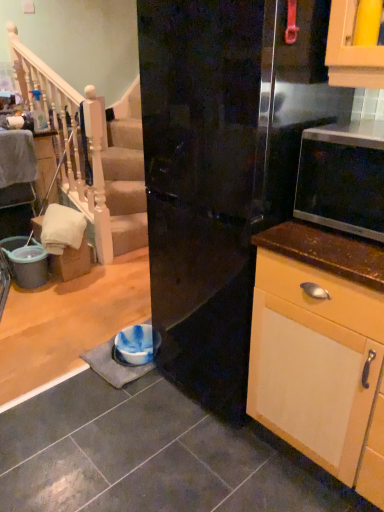
Measure the distance between point (115, 201) and camera.

Point (115, 201) and camera are 3.25 meters apart.

Describe the element at coordinates (91, 156) in the screenshot. I see `white wood railing at upper left` at that location.

What is the approximate height of glossy black refrigerator at center?

It is 5.27 feet.

Locate an element on the screen. white wood railing at upper left is located at coordinates (91, 156).

Can you tell me how much white wood railing at upper left and glossy black refrigerator at center differ in facing direction?

180 degrees.

Is point (93, 220) closer to viewer compared to point (192, 392)?

No, it is behind (192, 392).

Is white wood railing at upper left inside or outside of glossy black refrigerator at center?

white wood railing at upper left is located beyond the bounds of glossy black refrigerator at center.

Is glossy black refrigerator at center oriented towards matte black microwave at right?

No.

In the scene shown: Is glossy black refrigerator at center taller or shorter than matte black microwave at right?

glossy black refrigerator at center is taller than matte black microwave at right.

In the scene shown: Is glossy black refrigerator at center to the right of matte black microwave at right from the viewer's perspective?

Incorrect, glossy black refrigerator at center is not on the right side of matte black microwave at right.

Where is `microwave oven behind the glossy black refrigerator at center`? microwave oven behind the glossy black refrigerator at center is located at coordinates (343, 178).

How different are the orientations of matte black microwave at right and white wood railing at upper left in degrees?

179 degrees.

Between matte black microwave at right and white wood railing at upper left, which one has more height?

Answer: white wood railing at upper left is taller.

Is white wood railing at upper left at the back of matte black microwave at right?

matte black microwave at right is not turned away from white wood railing at upper left.

Can you confirm if matte black microwave at right is wider than white wood railing at upper left?

Yes, matte black microwave at right is wider than white wood railing at upper left.

Is white wood railing at upper left not inside matte black microwave at right?

white wood railing at upper left lies outside matte black microwave at right's area.

Looking at this image, from a real-world perspective, does white wood railing at upper left stand above matte black microwave at right?

No, from a real-world perspective, white wood railing at upper left is not above matte black microwave at right.

From the image's perspective, who appears lower, white wood railing at upper left or matte black microwave at right?

From the image's view, matte black microwave at right is below.

How many degrees apart are the facing directions of white wood railing at upper left and matte black microwave at right?

white wood railing at upper left and matte black microwave at right are facing 179 degrees away from each other.

Looking at this image, which is more to the left, matte black microwave at right or glossy black refrigerator at center?

Positioned to the left is glossy black refrigerator at center.

Considering the sizes of objects matte black microwave at right and glossy black refrigerator at center in the image provided, who is bigger, matte black microwave at right or glossy black refrigerator at center?

With larger size is glossy black refrigerator at center.

Could glossy black refrigerator at center be considered to be inside matte black microwave at right?

No, glossy black refrigerator at center is located outside of matte black microwave at right.

Which object is closer to the camera taking this photo, glossy black refrigerator at center or white wood railing at upper left?

glossy black refrigerator at center is in front.

Is glossy black refrigerator at center bigger or smaller than white wood railing at upper left?

Clearly, glossy black refrigerator at center is larger in size than white wood railing at upper left.

Is glossy black refrigerator at center inside the boundaries of white wood railing at upper left, or outside?

glossy black refrigerator at center cannot be found inside white wood railing at upper left.

Find the location of a particular element. The width and height of the screenshot is (384, 512). refrigerator in front of the white wood railing at upper left is located at coordinates (222, 169).

At what (x,y) coordinates should I click in order to perform the action: click on refrigerator in front of the white wood railing at upper left. Please return your answer as a coordinate pair (x, y). This screenshot has width=384, height=512. Looking at the image, I should click on (222, 169).

Locate an element on the screen. This screenshot has height=512, width=384. microwave oven above the glossy black refrigerator at center (from a real-world perspective) is located at coordinates (343, 178).

Which object lies nearer to the anchor point glossy black refrigerator at center, white wood railing at upper left or matte black microwave at right?

Among the two, matte black microwave at right is located nearer to glossy black refrigerator at center.

In the scene shown: When comparing their distances from matte black microwave at right, does glossy black refrigerator at center or white wood railing at upper left seem further?

Based on the image, white wood railing at upper left appears to be further to matte black microwave at right.

Which object lies further to the anchor point white wood railing at upper left, matte black microwave at right or glossy black refrigerator at center?

matte black microwave at right is further to white wood railing at upper left.

Looking at this image, looking at the image, which one is located closer to matte black microwave at right, white wood railing at upper left or glossy black refrigerator at center?

Based on the image, glossy black refrigerator at center appears to be nearer to matte black microwave at right.

Looking at the image, which one is located closer to white wood railing at upper left, glossy black refrigerator at center or matte black microwave at right?

Based on the image, glossy black refrigerator at center appears to be nearer to white wood railing at upper left.

Based on their spatial positions, is matte black microwave at right or white wood railing at upper left closer to glossy black refrigerator at center?

Based on the image, matte black microwave at right appears to be nearer to glossy black refrigerator at center.

Identify the location of refrigerator situated between white wood railing at upper left and matte black microwave at right from left to right. The width and height of the screenshot is (384, 512). (222, 169).